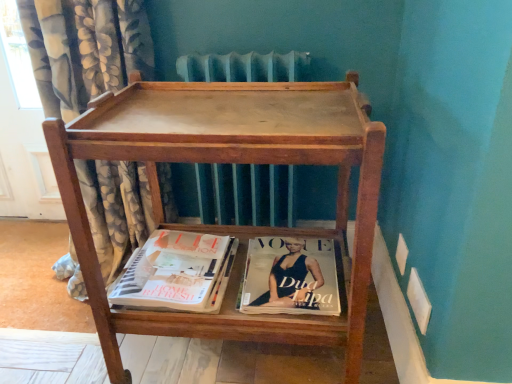
This screenshot has width=512, height=384. What do you see at coordinates (290, 277) in the screenshot?
I see `matte paper magazine at lower center` at bounding box center [290, 277].

Describe the element at coordinates (84, 49) in the screenshot. I see `floral fabric curtain at left` at that location.

Image resolution: width=512 pixels, height=384 pixels. Find the location of `matte paper magazine at lower center`. matte paper magazine at lower center is located at coordinates (176, 273).

The width and height of the screenshot is (512, 384). In order to click on matte paper magazine at lower center in this screenshot , I will do `click(290, 277)`.

Who is shorter, matte paper magazine at lower center or floral fabric curtain at left?

matte paper magazine at lower center is shorter.

Considering the positions of objects matte paper magazine at lower center and floral fabric curtain at left in the image provided, who is more to the left, matte paper magazine at lower center or floral fabric curtain at left?

floral fabric curtain at left is more to the left.

Considering the relative sizes of matte paper magazine at lower center and floral fabric curtain at left in the image provided, is matte paper magazine at lower center wider than floral fabric curtain at left?

In fact, matte paper magazine at lower center might be narrower than floral fabric curtain at left.

Would you consider matte paper magazine at lower center to be distant from floral fabric curtain at left?

That's not correct — matte paper magazine at lower center is a little close to floral fabric curtain at left.

Does matte paper magazine at lower center turn towards wooden tray at center?

Yes, matte paper magazine at lower center is turned towards wooden tray at center.

Considering the positions of point (271, 240) and point (205, 152), is point (271, 240) closer or farther from the camera than point (205, 152)?

Point (271, 240) appears to be farther away from the viewer than point (205, 152).

From the image's perspective, does matte paper magazine at lower center appear lower than wooden tray at center?

Correct, matte paper magazine at lower center appears lower than wooden tray at center in the image.

How different are the orientations of matte paper magazine at lower center and wooden tray at center in degrees?

The angular difference between matte paper magazine at lower center and wooden tray at center is 1.19 degrees.

From a real-world perspective, is wooden tray at center located higher than matte paper magazine at lower center?

Yes, from a real-world perspective, wooden tray at center is above matte paper magazine at lower center.

Between wooden tray at center and matte paper magazine at lower center, which one appears on the left side from the viewer's perspective?

wooden tray at center.

Considering the relative sizes of wooden tray at center and matte paper magazine at lower center in the image provided, is wooden tray at center bigger than matte paper magazine at lower center?

Yes.

Who is shorter, wooden tray at center or matte paper magazine at lower center?

matte paper magazine at lower center.

From the image's perspective, does wooden tray at center appear lower than matte paper magazine at lower center?

Actually, wooden tray at center appears above matte paper magazine at lower center in the image.

In the scene shown: Does wooden tray at center come behind matte paper magazine at lower center?

No, it is in front of matte paper magazine at lower center.

Considering the relative positions of wooden tray at center and matte paper magazine at lower center in the image provided, is wooden tray at center to the right of matte paper magazine at lower center from the viewer's perspective?

Yes, wooden tray at center is to the right of matte paper magazine at lower center.

Is wooden tray at center spatially inside matte paper magazine at lower center, or outside of it?

wooden tray at center is spatially situated outside matte paper magazine at lower center.

Would you say floral fabric curtain at left is part of wooden tray at center's contents?

That's incorrect, floral fabric curtain at left is not inside wooden tray at center.

Between wooden tray at center and floral fabric curtain at left, which one has smaller width?

wooden tray at center.

From the image's perspective, between wooden tray at center and floral fabric curtain at left, who is located below?

wooden tray at center.

Is wooden tray at center to the right of floral fabric curtain at left from the viewer's perspective?

Yes, wooden tray at center is to the right of floral fabric curtain at left.

Considering the relative sizes of floral fabric curtain at left and matte paper magazine at lower center in the image provided, is floral fabric curtain at left thinner than matte paper magazine at lower center?

No, floral fabric curtain at left is not thinner than matte paper magazine at lower center.

From a real-world perspective, is floral fabric curtain at left on matte paper magazine at lower center?

Yes.

Consider the image. Is floral fabric curtain at left oriented away from matte paper magazine at lower center?

No, floral fabric curtain at left is not facing the opposite direction of matte paper magazine at lower center.

Which is farther, (54, 46) or (247, 303)?

Positioned behind is point (54, 46).

Which is more to the left, matte paper magazine at lower center or wooden tray at center?

From the viewer's perspective, matte paper magazine at lower center appears more on the left side.

Does matte paper magazine at lower center have a greater width compared to wooden tray at center?

→ No, matte paper magazine at lower center is not wider than wooden tray at center.

Is matte paper magazine at lower center directly adjacent to wooden tray at center?

matte paper magazine at lower center is not next to wooden tray at center, and they're not touching.

Can you confirm if matte paper magazine at lower center is taller than wooden tray at center?

No, matte paper magazine at lower center is not taller than wooden tray at center.

Where is `person directly beneath the floral fabric curtain at left (from a real-world perspective)`? Image resolution: width=512 pixels, height=384 pixels. person directly beneath the floral fabric curtain at left (from a real-world perspective) is located at coordinates (290, 277).

In the image, there is a wooden tray at center. Identify the location of person below it (from the image's perspective). 290,277.

From the picture: When comparing their distances from floral fabric curtain at left, does wooden tray at center or matte paper magazine at lower center seem closer?

wooden tray at center is positioned closer to the anchor floral fabric curtain at left.

From the image, which object appears to be farther from matte paper magazine at lower center, floral fabric curtain at left or matte paper magazine at lower center?

floral fabric curtain at left is positioned further to the anchor matte paper magazine at lower center.

Which object lies nearer to the anchor point floral fabric curtain at left, matte paper magazine at lower center or matte paper magazine at lower center?

Based on the image, matte paper magazine at lower center appears to be nearer to floral fabric curtain at left.

Which object lies nearer to the anchor point floral fabric curtain at left, matte paper magazine at lower center or matte paper magazine at lower center?

matte paper magazine at lower center.

Based on their spatial positions, is matte paper magazine at lower center or matte paper magazine at lower center closer to wooden tray at center?

matte paper magazine at lower center is positioned closer to the anchor wooden tray at center.

Based on their spatial positions, is matte paper magazine at lower center or floral fabric curtain at left further from wooden tray at center?

floral fabric curtain at left lies further to wooden tray at center than the other object.

From the image, which object appears to be farther from matte paper magazine at lower center, floral fabric curtain at left or matte paper magazine at lower center?

Among the two, floral fabric curtain at left is located further to matte paper magazine at lower center.

Estimate the real-world distances between objects in this image. Which object is closer to matte paper magazine at lower center, matte paper magazine at lower center or floral fabric curtain at left?

The object closer to matte paper magazine at lower center is matte paper magazine at lower center.

Identify the location of book located between wooden tray at center and matte paper magazine at lower center in the depth direction. This screenshot has height=384, width=512. (176, 273).

Locate an element on the screen. furniture located between floral fabric curtain at left and matte paper magazine at lower center in the left-right direction is located at coordinates (229, 162).

Identify the location of book between floral fabric curtain at left and wooden tray at center from left to right. The width and height of the screenshot is (512, 384). (176, 273).

Locate an element on the screen. book located between floral fabric curtain at left and matte paper magazine at lower center in the left-right direction is located at coordinates (176, 273).